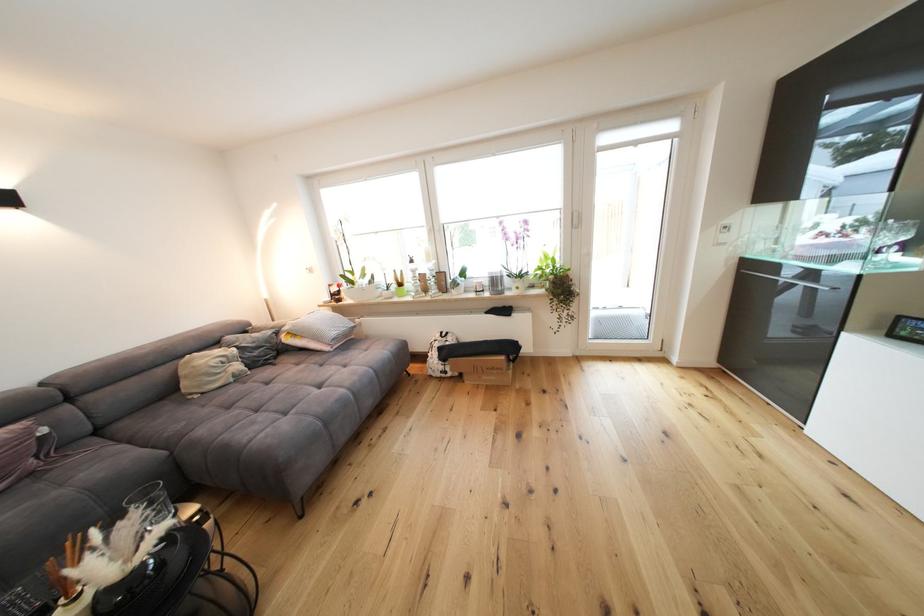
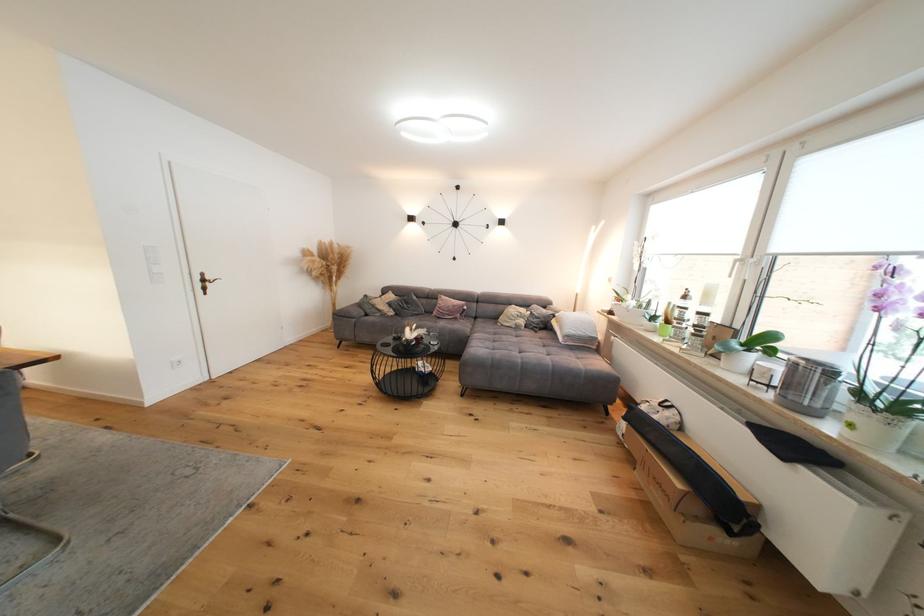
Where in the second image is the point corresponding to pixel 436 233 from the first image?

(744, 262)